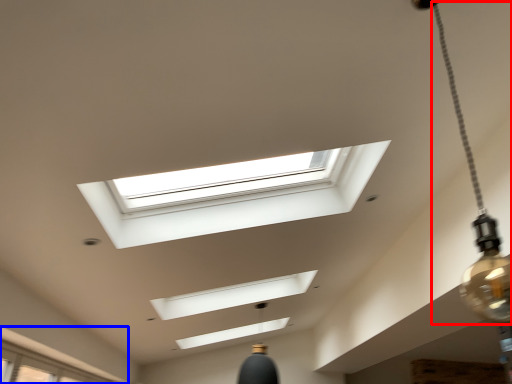
Question: Among these objects, which one is farthest to the camera, lamp (highlighted by a red box) or window (highlighted by a blue box)?

Choices:
 (A) lamp
 (B) window

Answer: (B)